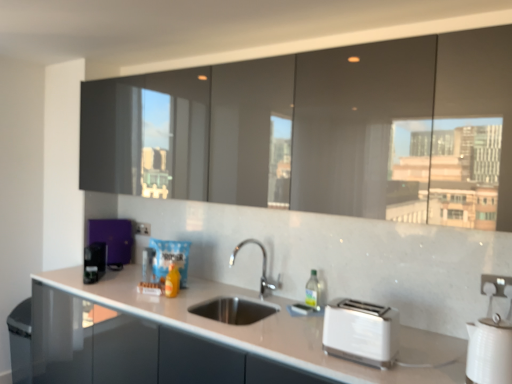
Find the location of a particular element. The width and height of the screenshot is (512, 384). free space to the left of metallic silver toaster at center, placed as the 3th appliance when sorted from left to right is located at coordinates (118, 281).